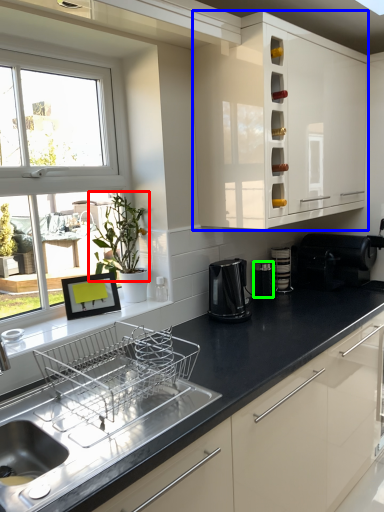
Question: Based on their relative distances, which object is farther from plant (highlighted by a red box)? Choose from cabinetry (highlighted by a blue box) and appliance (highlighted by a green box).

Choices:
 (A) cabinetry
 (B) appliance

Answer: (B)